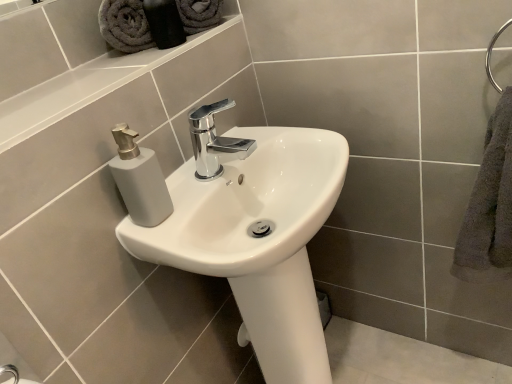
Image resolution: width=512 pixels, height=384 pixels. What do you see at coordinates (489, 206) in the screenshot? I see `gray fluffy towel at right, which is counted as the second bath towel, starting from the left` at bounding box center [489, 206].

Find the location of a particular element. gray fluffy towel at right, which is the 2th bath towel in top-to-bottom order is located at coordinates (489, 206).

The height and width of the screenshot is (384, 512). What do you see at coordinates (164, 23) in the screenshot?
I see `gray fabric towels at upper left` at bounding box center [164, 23].

Identify the location of chrome metallic faucet at center. (214, 141).

What do you see at coordinates (83, 87) in the screenshot?
I see `white glossy ledge at upper left` at bounding box center [83, 87].

Locate an element on the screen. The height and width of the screenshot is (384, 512). gray fluffy towel at right, which ranks as the first bath towel in bottom-to-top order is located at coordinates (489, 206).

Is chrome metallic faucet at center wider or thinner than white glossy sink at center?

In the image, chrome metallic faucet at center appears to be more narrow than white glossy sink at center.

Which is correct: chrome metallic faucet at center is inside white glossy sink at center, or outside of it?

chrome metallic faucet at center exists outside the volume of white glossy sink at center.

Is chrome metallic faucet at center to the right of white glossy sink at center from the viewer's perspective?

Incorrect, chrome metallic faucet at center is not on the right side of white glossy sink at center.

Measure the distance between chrome metallic faucet at center and white glossy sink at center.

chrome metallic faucet at center and white glossy sink at center are 17.48 centimeters apart from each other.

Is gray fabric towels at upper left completely or partially inside chrome metallic faucet at center?

No, gray fabric towels at upper left is not inside chrome metallic faucet at center.

Looking at this image, is chrome metallic faucet at center aimed at gray fabric towels at upper left?

No.

From the image's perspective, which object appears higher, chrome metallic faucet at center or gray fabric towels at upper left?

gray fabric towels at upper left appears higher in the image.

In the image, there is a gray fabric towels at upper left. Identify the location of tap below it (from the image's perspective). click(214, 141).

Relative to white glossy sink at center, is gray cotton towel at upper left, positioned as the 1th bath towel in left-to-right order, in front or behind?

Visually, gray cotton towel at upper left, positioned as the 1th bath towel in left-to-right order, is located behind white glossy sink at center.

Between gray cotton towel at upper left, the second bath towel when ordered from bottom to top, and white glossy sink at center, which one has more height?

white glossy sink at center.

Could you tell me if gray cotton towel at upper left, the second bath towel when ordered from bottom to top, is facing white glossy sink at center?

No, gray cotton towel at upper left, the second bath towel when ordered from bottom to top, is not aimed at white glossy sink at center.

The image size is (512, 384). What are the coordinates of `sink below the white glossy ledge at upper left (from the image's perspective)` in the screenshot? It's located at (243, 227).

Which of these two, white glossy ledge at upper left or white glossy sink at center, stands taller?

Standing taller between the two is white glossy sink at center.

Is point (70, 103) farther from viewer compared to point (138, 191)?

No, (70, 103) is closer to viewer.

Considering the relative sizes of white glossy ledge at upper left and white glossy sink at center in the image provided, is white glossy ledge at upper left thinner than white glossy sink at center?

Correct, the width of white glossy ledge at upper left is less than that of white glossy sink at center.

Which is correct: white glossy sink at center is inside white glossy ledge at upper left, or outside of it?

white glossy sink at center exists outside the volume of white glossy ledge at upper left.

Identify the location of ledge behind the white glossy sink at center. This screenshot has width=512, height=384. (83, 87).

Does point (248, 142) come farther from viewer compared to point (131, 67)?

Yes, point (248, 142) is farther from viewer.

From the image's perspective, who appears lower, white glossy ledge at upper left or gray fabric towels at upper left?

white glossy ledge at upper left is shown below in the image.

Is white glossy ledge at upper left in front of gray fabric towels at upper left?

Yes, the depth of white glossy ledge at upper left is less than that of gray fabric towels at upper left.

Which is less distant, (105,63) or (162,22)?

The point (162,22) is closer.

Measure the distance from white glossy ledge at upper left to gray fabric towels at upper left.

7.55 inches.

Is white glossy ledge at upper left in contact with gray cotton towel at upper left, positioned as the second bath towel in right-to-left order?

white glossy ledge at upper left and gray cotton towel at upper left, positioned as the second bath towel in right-to-left order, are not in contact.

From the image's perspective, which object appears higher, white glossy ledge at upper left or gray cotton towel at upper left, the second bath towel when ordered from bottom to top?

From the image's view, gray cotton towel at upper left, the second bath towel when ordered from bottom to top, is above.

Is white glossy ledge at upper left facing away from gray cotton towel at upper left, positioned as the 1th bath towel in left-to-right order?

No, white glossy ledge at upper left is not facing away from gray cotton towel at upper left, positioned as the 1th bath towel in left-to-right order.

Considering the relative positions of white glossy ledge at upper left and gray cotton towel at upper left, the second bath towel when ordered from bottom to top, in the image provided, is white glossy ledge at upper left to the right of gray cotton towel at upper left, the second bath towel when ordered from bottom to top, from the viewer's perspective?

No.

Identify the location of sink located underneath the chrome metallic faucet at center (from a real-world perspective). This screenshot has height=384, width=512. (243, 227).

Where is `toiletry above the chrome metallic faucet at center (from a real-world perspective)`? toiletry above the chrome metallic faucet at center (from a real-world perspective) is located at coordinates (164, 23).

When comparing their distances from white glossy sink at center, does gray fluffy towel at right, which ranks as the first bath towel in bottom-to-top order, or white glossy ledge at upper left seem closer?

white glossy ledge at upper left is positioned closer to the anchor white glossy sink at center.

Looking at the image, which one is located further to gray fluffy towel at right, which is the 2th bath towel in top-to-bottom order, gray fabric towels at upper left or white glossy ledge at upper left?

white glossy ledge at upper left is further to gray fluffy towel at right, which is the 2th bath towel in top-to-bottom order.

Looking at this image, based on their spatial positions, is white glossy sink at center or gray cotton towel at upper left, positioned as the 1th bath towel in left-to-right order, further from white glossy ledge at upper left?

white glossy sink at center lies further to white glossy ledge at upper left than the other object.

Looking at the image, which one is located further to gray fabric towels at upper left, chrome metallic faucet at center or gray fluffy towel at right, which is counted as the second bath towel, starting from the left?

Among the two, gray fluffy towel at right, which is counted as the second bath towel, starting from the left, is located further to gray fabric towels at upper left.

Consider the image. Estimate the real-world distances between objects in this image. Which object is further from chrome metallic faucet at center, gray fabric towels at upper left or white glossy sink at center?

Based on the image, gray fabric towels at upper left appears to be further to chrome metallic faucet at center.

Looking at the image, which one is located closer to white glossy sink at center, white glossy ledge at upper left or gray fabric towels at upper left?

white glossy ledge at upper left.

From the image, which object appears to be farther from white glossy ledge at upper left, chrome metallic faucet at center or gray fabric towels at upper left?

chrome metallic faucet at center is positioned further to the anchor white glossy ledge at upper left.

Considering their positions, is gray cotton towel at upper left, the second bath towel when ordered from bottom to top, positioned closer to chrome metallic faucet at center than white glossy sink at center?

white glossy sink at center lies closer to chrome metallic faucet at center than the other object.

I want to click on toiletry between white glossy ledge at upper left and gray cotton towel at upper left, acting as the first bath towel starting from the top, from front to back, so click(164, 23).

You are a GUI agent. You are given a task and a screenshot of the screen. Output one action in this format:
    pyautogui.click(x=<x>, y=<y>)
    Task: Click on the toiletry located between white glossy ledge at upper left and gray fluffy towel at right, which appears as the first bath towel when viewed from the right, in the left-right direction
    
    Given the screenshot: What is the action you would take?
    pyautogui.click(x=164, y=23)

Locate an element on the screen. Image resolution: width=512 pixels, height=384 pixels. sink between chrome metallic faucet at center and gray fluffy towel at right, which is counted as the second bath towel, starting from the left is located at coordinates (243, 227).

At what (x,y) coordinates should I click in order to perform the action: click on toiletry located between gray cotton towel at upper left, the second bath towel when ordered from bottom to top, and gray fluffy towel at right, which is the 2th bath towel in top-to-bottom order, in the left-right direction. Please return your answer as a coordinate pair (x, y). Looking at the image, I should click on (164, 23).